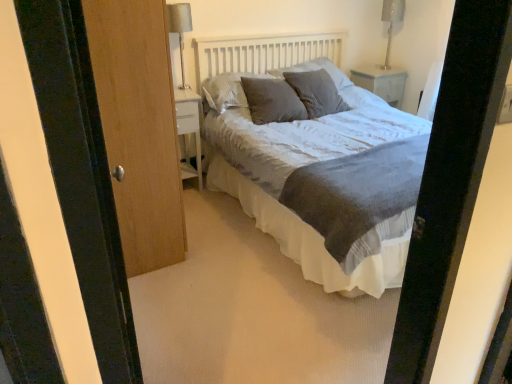
Question: Considering the positions of textured gray pillow at center, positioned as the third pillow in right-to-left order, and metallic silver table lamp at upper right, placed as the first table lamp when sorted from back to front, in the image, is textured gray pillow at center, positioned as the third pillow in right-to-left order, taller or shorter than metallic silver table lamp at upper right, placed as the first table lamp when sorted from back to front,?

Choices:
 (A) short
 (B) tall

Answer: (A)

Question: Does point (291, 117) appear closer or farther from the camera than point (389, 6)?

Choices:
 (A) farther
 (B) closer

Answer: (B)

Question: Estimate the real-world distances between objects in this image. Which object is closer to the white glossy nightstand at upper right, which ranks as the first nightstand in top-to-bottom order?

Choices:
 (A) wooden door at left
 (B) textured gray pillow at center, the 4th pillow positioned from the left
 (C) textured gray pillow at center, positioned as the third pillow in right-to-left order
 (D) textured gray bed at center
 (E) textured gray pillow at center, the fourth pillow positioned from the right

Answer: (B)

Question: Considering the real-world distances, which object is closest to the textured gray pillow at center, the fourth pillow positioned from the right?

Choices:
 (A) textured gray pillow at center, positioned as the third pillow in right-to-left order
 (B) wooden door at left
 (C) textured gray pillow at center, which is the first pillow from right to left
 (D) white glossy nightstand at upper right, which ranks as the first nightstand in top-to-bottom order
 (E) silver metallic table lamp at upper left, which is counted as the 2th table lamp, starting from the back

Answer: (A)